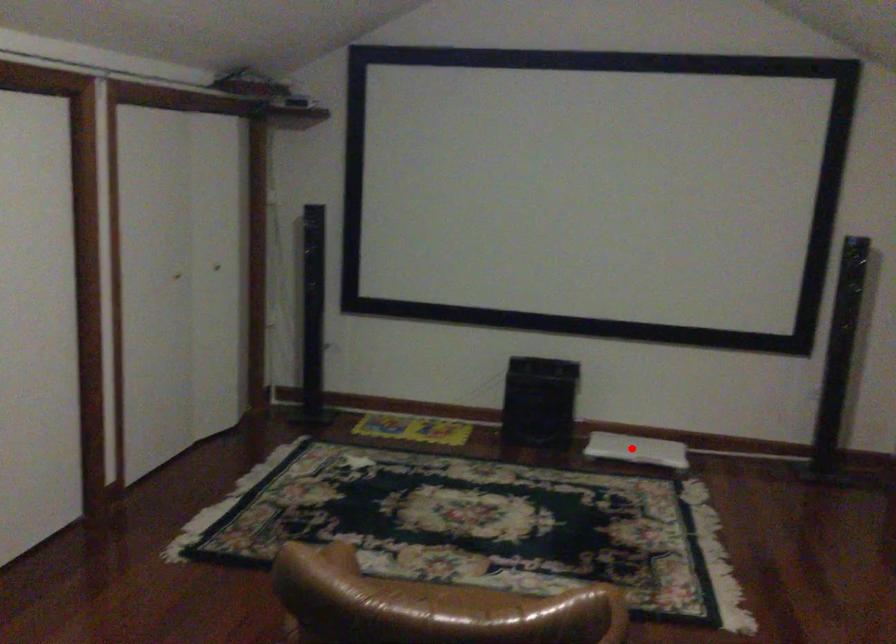
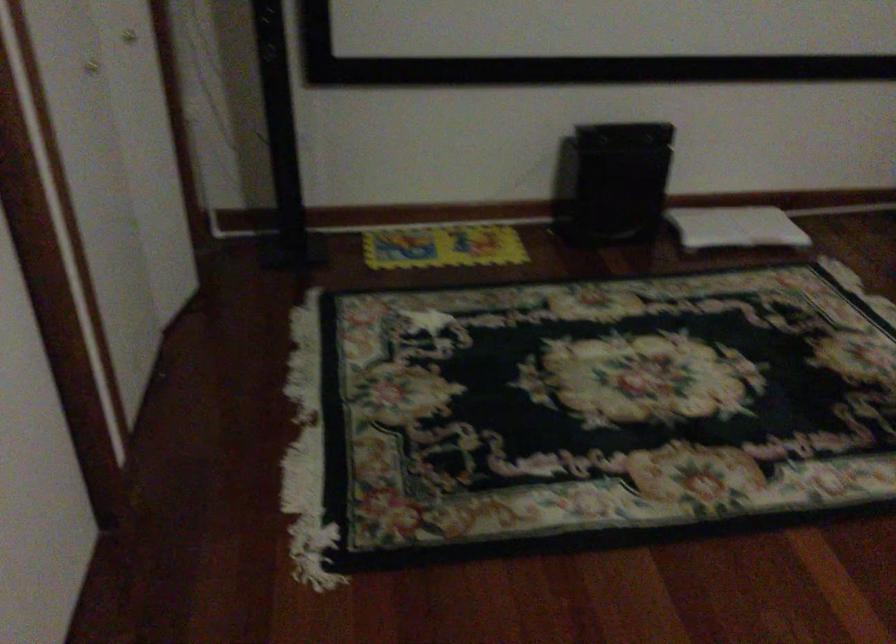
Question: I am providing you with two images of the same scene from different viewpoints. Image1 has a red point marked. In image2, the corresponding 3D location appears at what relative position? Reply with the corresponding letter.

Choices:
 (A) Closer
 (B) Farther

Answer: (A)